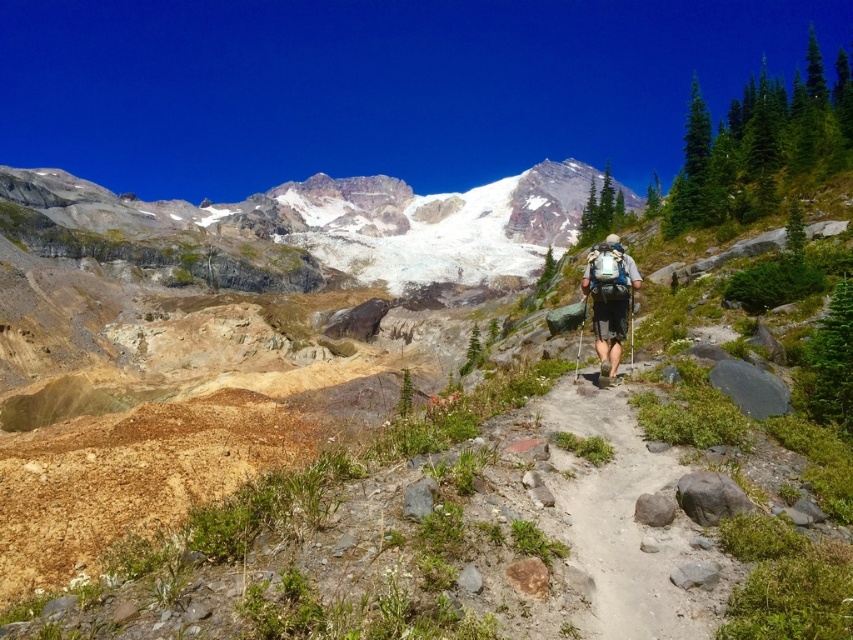
Can you confirm if dirt path at center is smaller than matte green backpack at center?

Incorrect, dirt path at center is not smaller in size than matte green backpack at center.

Which of these two, dirt path at center or matte green backpack at center, stands taller?

matte green backpack at center is taller.

Who is more distant from viewer, (605, 634) or (598, 264)?

The point (598, 264) is behind.

Find the location of a particular element. The image size is (853, 640). dirt path at center is located at coordinates (625, 520).

Which is behind, point (231, 216) or point (604, 342)?

The point (231, 216) is behind.

Does point (21, 228) lie in front of point (602, 330)?

No.

You are a GUI agent. You are given a task and a screenshot of the screen. Output one action in this format:
    pyautogui.click(x=<x>, y=<y>)
    Task: Click on the snowy granite mountain at center
    This screenshot has width=853, height=640.
    Given the screenshot: What is the action you would take?
    pyautogui.click(x=305, y=228)

Is snowy granite mountain at center closer to camera compared to dirt path at center?

No, snowy granite mountain at center is further to the viewer.

Does snowy granite mountain at center appear on the left side of dirt path at center?

Correct, you'll find snowy granite mountain at center to the left of dirt path at center.

Between point (108, 216) and point (587, 506), which one is positioned in front?

Positioned in front is point (587, 506).

Where is `snowy granite mountain at center`? Image resolution: width=853 pixels, height=640 pixels. snowy granite mountain at center is located at coordinates (305, 228).